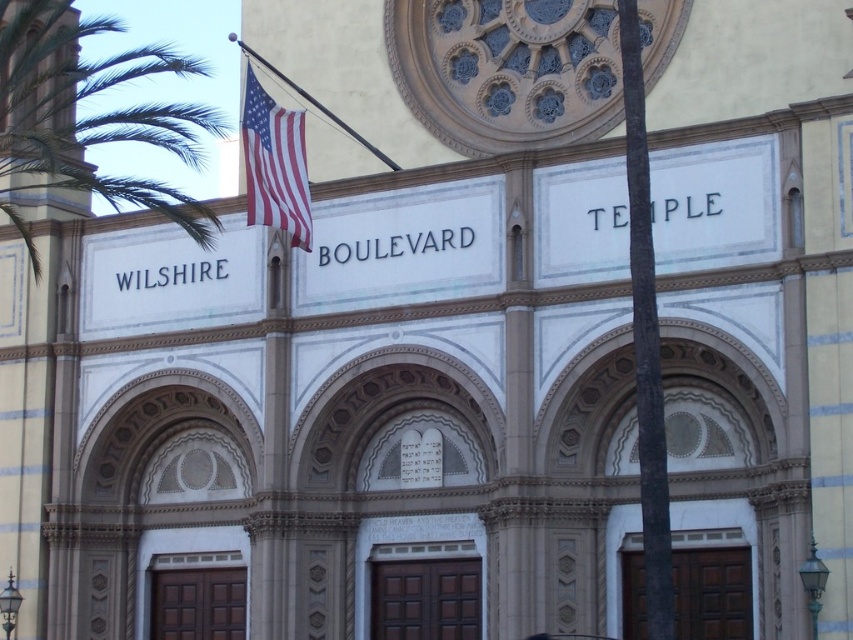
Is green leafy palm tree at left below american flag at upper left?

No, green leafy palm tree at left is not below american flag at upper left.

Identify the location of green leafy palm tree at left. (90, 115).

Locate an element on the screen. This screenshot has width=853, height=640. green leafy palm tree at left is located at coordinates (90, 115).